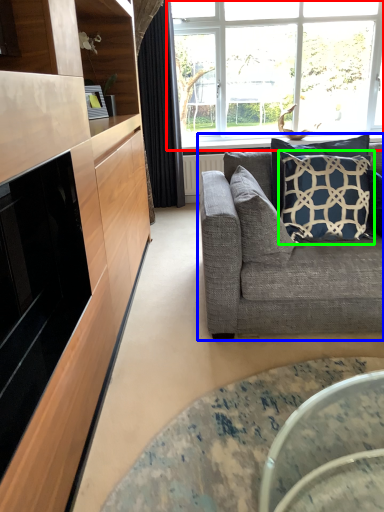
Question: Which object is the farthest from window (highlighted by a red box)? Choose among these: studio couch (highlighted by a blue box) or pillow (highlighted by a green box).

Choices:
 (A) studio couch
 (B) pillow

Answer: (A)